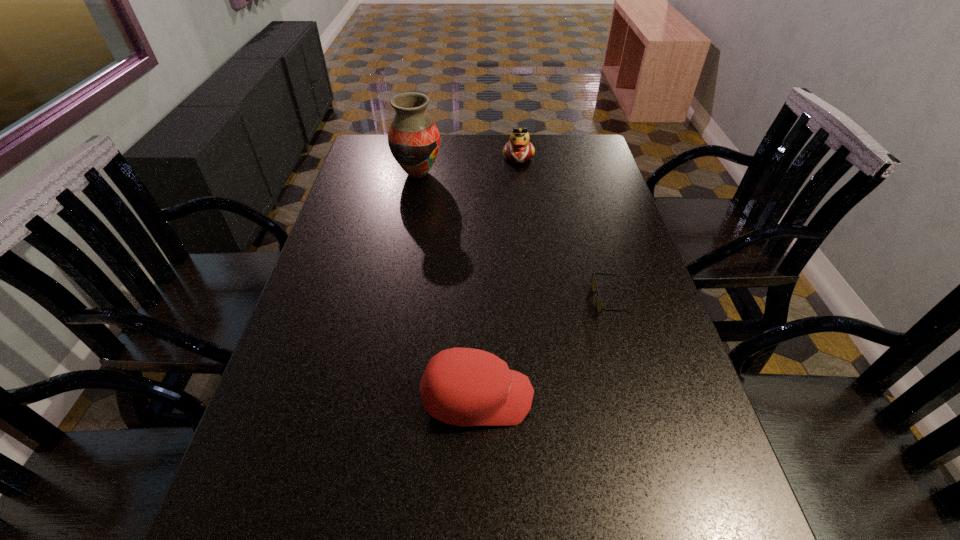
Identify the location of empty space that is in between the nearest object and the duck. 498,277.

Locate an element on the screen. The image size is (960, 540). free spot between the shortest object and the leftmost object is located at coordinates (514, 237).

Identify which object is the closest to the vase. Please provide its 2D coordinates. Your answer should be formatted as a tuple, i.e. [(x, y)], where the tuple contains the x and y coordinates of a point satisfying the conditions above.

[(518, 149)]

Find the location of a particular element. This screenshot has width=960, height=540. object that is the third closest to the second nearest object is located at coordinates (414, 140).